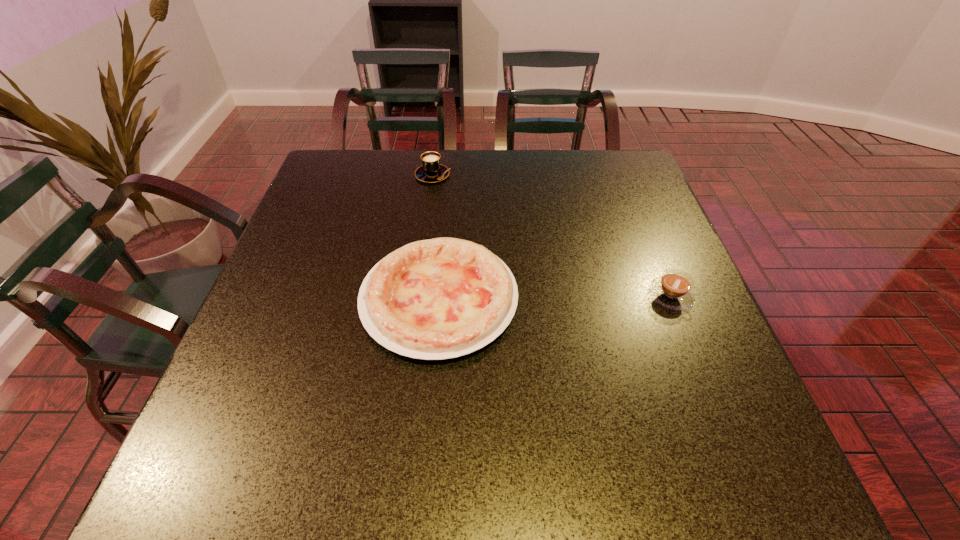
In the image, there is a desktop. Identify the location of free region at the far edge. (383, 160).

In the image, there is a desktop. Where is `vacant space at the near edge`? vacant space at the near edge is located at coordinates (566, 484).

Locate an element on the screen. free space at the left edge of the desktop is located at coordinates (299, 321).

In the image, there is a desktop. Where is `vacant space at the right edge`? vacant space at the right edge is located at coordinates (672, 253).

Locate an element on the screen. vacant space at the far left corner of the desktop is located at coordinates (362, 193).

Where is `free location at the near left corner`? The height and width of the screenshot is (540, 960). free location at the near left corner is located at coordinates (244, 474).

At what (x,y) coordinates should I click in order to perform the action: click on vacant region between the right cappuccino and the pizza. Please return your answer as a coordinate pair (x, y). Image resolution: width=960 pixels, height=540 pixels. Looking at the image, I should click on (555, 298).

This screenshot has width=960, height=540. Find the location of `free space between the left cappuccino and the right cappuccino`. free space between the left cappuccino and the right cappuccino is located at coordinates (552, 235).

Where is `unoccupied position between the pizza and the farther cappuccino`? The height and width of the screenshot is (540, 960). unoccupied position between the pizza and the farther cappuccino is located at coordinates (436, 237).

This screenshot has height=540, width=960. In order to click on unoccupied position between the left cappuccino and the nearer cappuccino in this screenshot , I will do `click(552, 235)`.